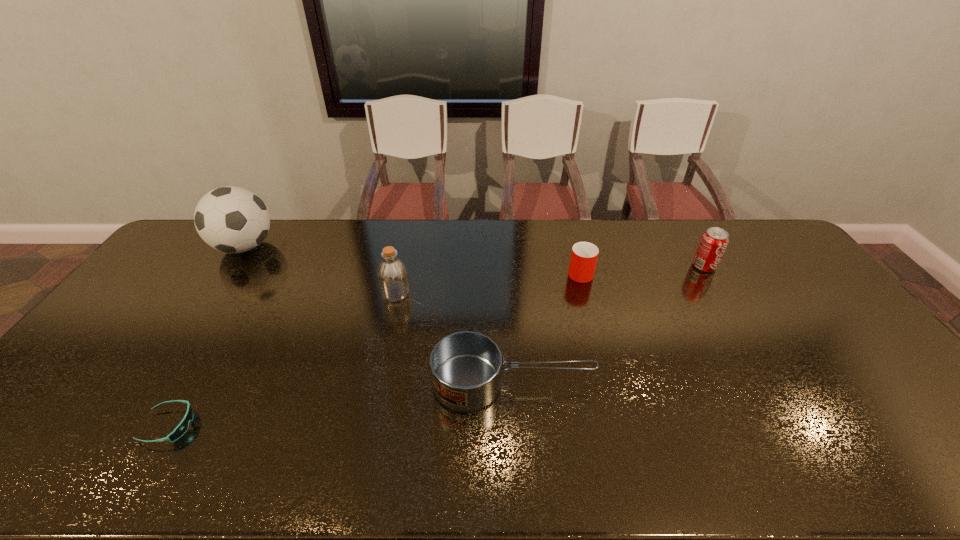
Identify the location of object at the far left corner. This screenshot has width=960, height=540. (231, 219).

At what (x,y) coordinates should I click in order to perform the action: click on vacant area at the far edge. Please return your answer as a coordinate pair (x, y). The height and width of the screenshot is (540, 960). Looking at the image, I should click on (466, 221).

The height and width of the screenshot is (540, 960). I want to click on free space at the near edge of the desktop, so click(x=270, y=461).

Find the location of a particular element. The image size is (960, 540). free space at the left edge is located at coordinates (149, 334).

What are the coordinates of `vacant space at the right edge of the desktop` in the screenshot? It's located at (856, 404).

Where is `unoccupied position between the tallest object and the fourth object from right to left`? This screenshot has height=540, width=960. unoccupied position between the tallest object and the fourth object from right to left is located at coordinates (321, 270).

This screenshot has height=540, width=960. Find the location of `vacant area that lies between the tallest object and the fourth object from right to left`. vacant area that lies between the tallest object and the fourth object from right to left is located at coordinates (321, 270).

You are a GUI agent. You are given a task and a screenshot of the screen. Output one action in this format:
    pyautogui.click(x=<x>, y=<y>)
    Task: Click on the empty location between the saucepan and the soccer ball
    The height and width of the screenshot is (540, 960).
    Given the screenshot: What is the action you would take?
    pyautogui.click(x=378, y=315)

Where is `vacant space that's between the saucepan and the shortest object`? The image size is (960, 540). vacant space that's between the saucepan and the shortest object is located at coordinates (x=341, y=404).

Locate an element on the screen. The width and height of the screenshot is (960, 540). empty space between the soccer ball and the saucepan is located at coordinates (378, 315).